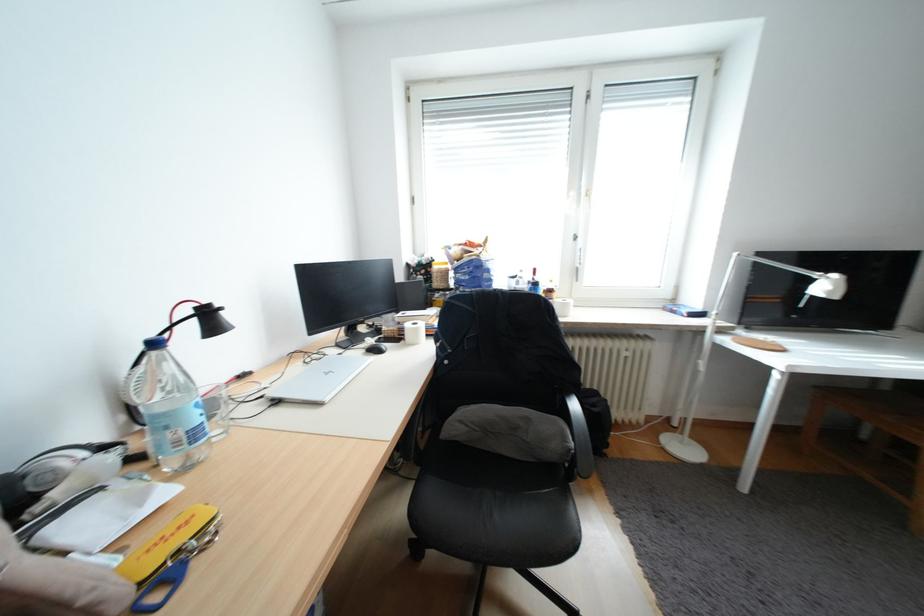
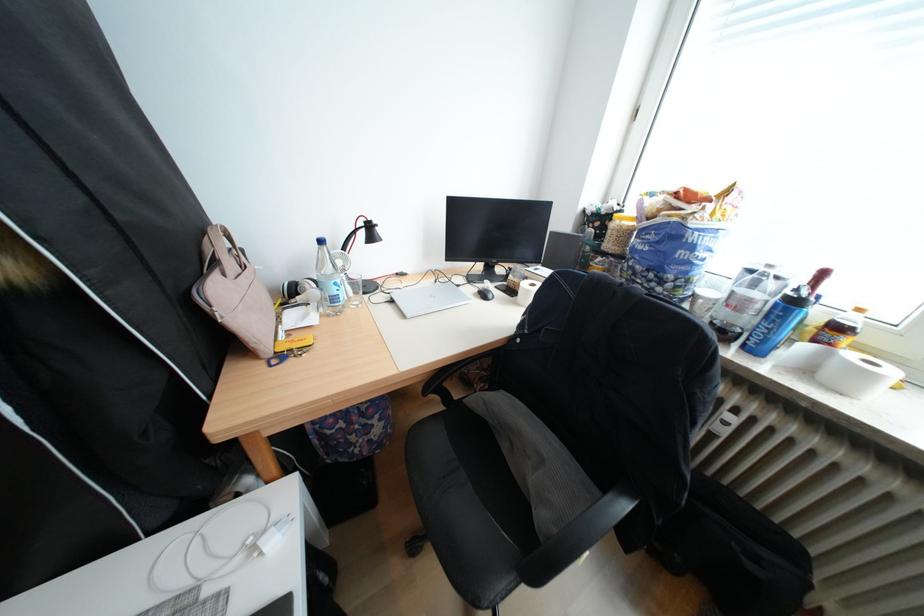
In the second image, find the point that corresponds to the point at 128,484 in the first image.

(325, 306)